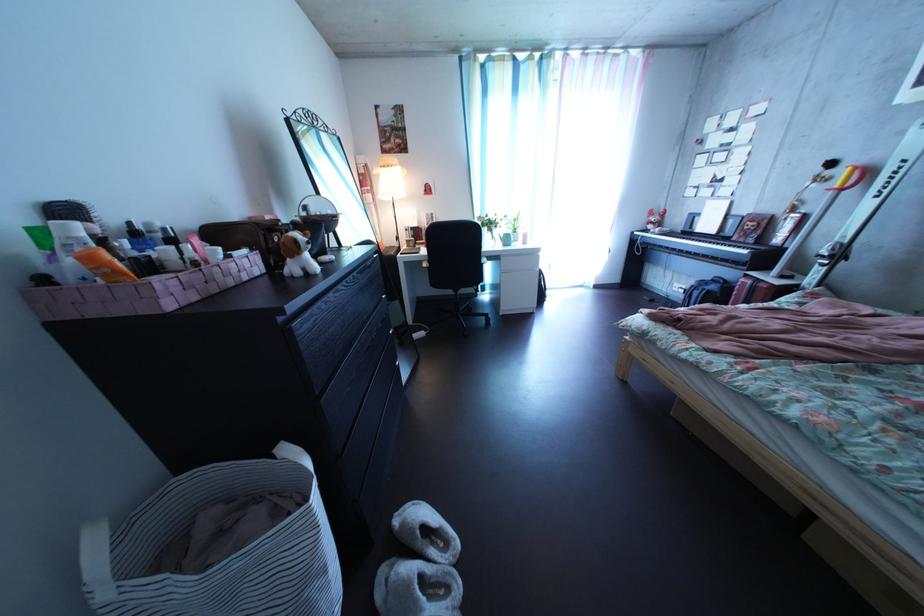
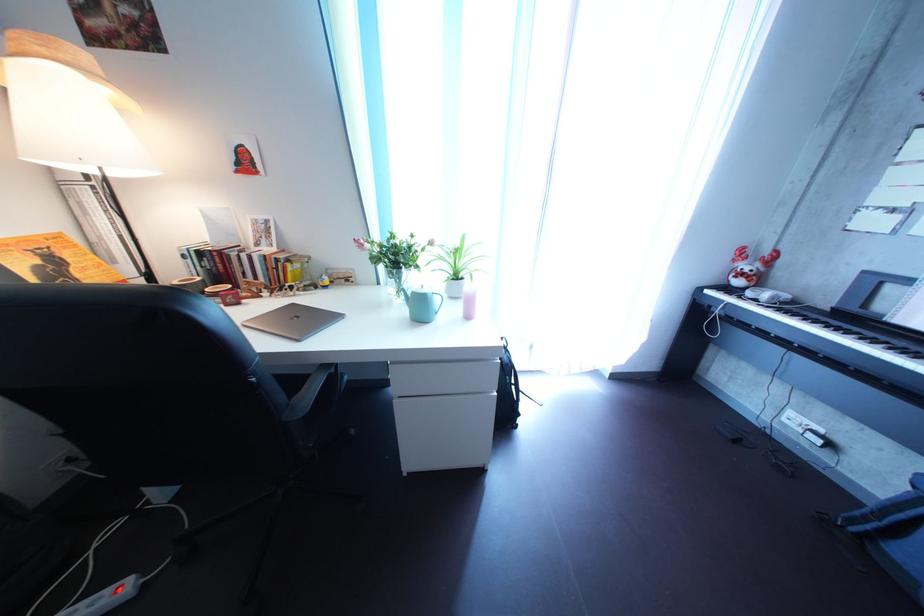
Find the pixel in the second image that matches the point at 520,248 in the first image.

(433, 315)